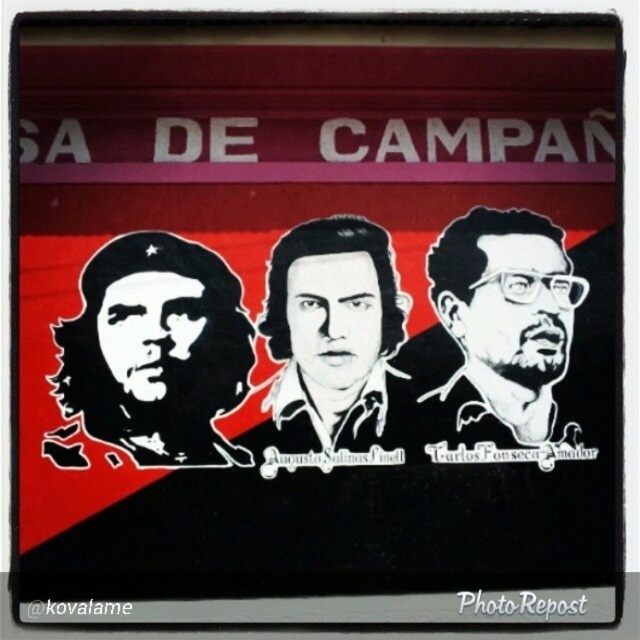
Question: Does black ink portrait at right appear on the right side of black matte portrait at center?

Choices:
 (A) yes
 (B) no

Answer: (A)

Question: Which of the following is the closest to the observer?

Choices:
 (A) (301, 406)
 (B) (480, 385)
 (C) (170, 244)

Answer: (A)

Question: Estimate the real-world distances between objects in this image. Which object is farther from the black matte portrait at center?

Choices:
 (A) black ink portrait at right
 (B) black matte portrait at left

Answer: (B)

Question: Does black matte portrait at left appear on the right side of black matte portrait at center?

Choices:
 (A) yes
 (B) no

Answer: (B)

Question: Based on their relative distances, which object is farther from the black ink portrait at right?

Choices:
 (A) black matte portrait at left
 (B) black matte portrait at center

Answer: (A)

Question: Can you confirm if black ink portrait at right is positioned to the right of black matte portrait at center?

Choices:
 (A) yes
 (B) no

Answer: (A)